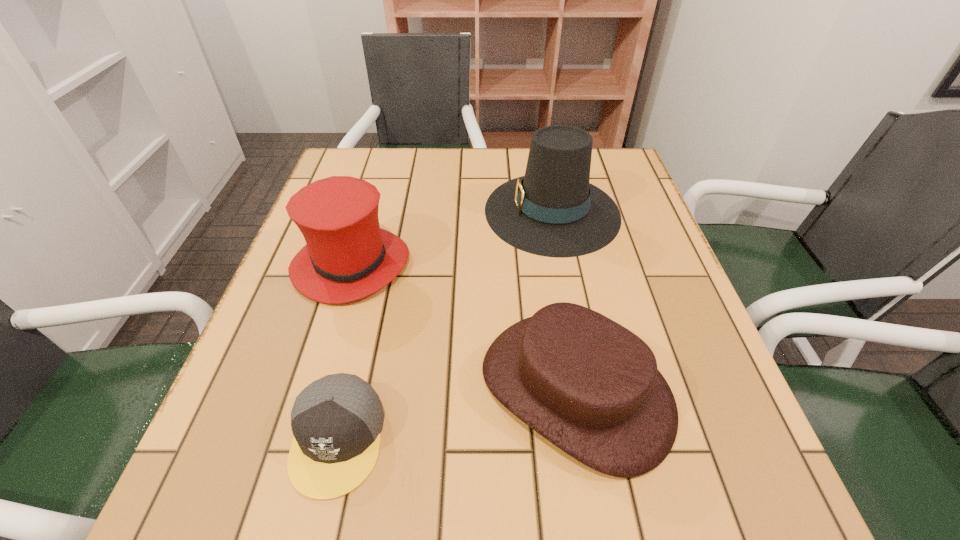
Identify the location of the tallest object. This screenshot has width=960, height=540. (553, 211).

Image resolution: width=960 pixels, height=540 pixels. Identify the location of the second shortest hat. (347, 256).

Identify the location of the leftmost hat. This screenshot has width=960, height=540. (347, 256).

The height and width of the screenshot is (540, 960). In order to click on the third tallest object in this screenshot , I will do `click(591, 387)`.

The image size is (960, 540). I want to click on the shortest hat, so click(x=591, y=387).

At what (x,y) coordinates should I click in order to perform the action: click on the shortest object. Please return your answer as a coordinate pair (x, y). Image resolution: width=960 pixels, height=540 pixels. Looking at the image, I should click on click(336, 421).

The image size is (960, 540). What are the coordinates of `free space located 0.070m on the front-facing side of the tallest object` in the screenshot? It's located at (457, 211).

In order to click on free location located on the front-facing side of the tallest object in this screenshot , I will do `click(425, 211)`.

This screenshot has width=960, height=540. Find the location of `vacant space located on the front-facing side of the tallest object`. vacant space located on the front-facing side of the tallest object is located at coordinates (453, 211).

This screenshot has height=540, width=960. Identify the location of free space located on the back of the second tallest hat. (368, 210).